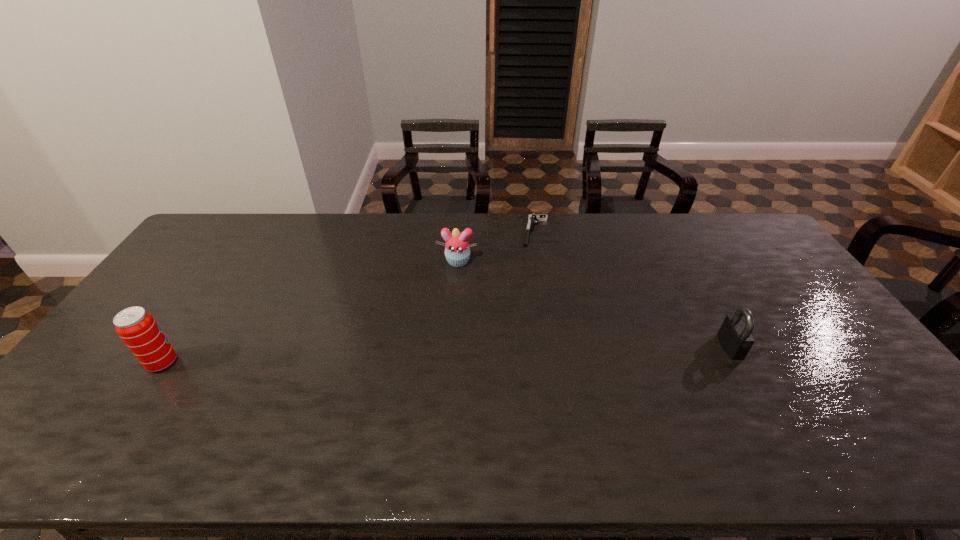
Identify the location of free space that is in between the cupcake and the tallest object. The image size is (960, 540). (310, 312).

Locate an element on the screen. This screenshot has height=540, width=960. free spot between the second farthest object and the farthest object is located at coordinates (496, 246).

This screenshot has height=540, width=960. Find the location of `vacant area that lies between the second object from right to left and the tallest object`. vacant area that lies between the second object from right to left and the tallest object is located at coordinates (348, 297).

Find the location of a particular element. object that is the second closest one to the cupcake is located at coordinates (735, 335).

Locate an element on the screen. The width and height of the screenshot is (960, 540). object that is the closest to the third object from right to left is located at coordinates (532, 218).

Find the location of a particular element. The height and width of the screenshot is (540, 960). vacant area in the image that satisfies the following two spatial constraints: 1. on the front side of the rightmost object; 2. on the front of the third object from right to left near the keyhole is located at coordinates (452, 346).

Find the location of `free location that satisfies the following two spatial constraints: 1. on the front side of the padlock; 2. on the front of the third nearest object near the keyhole`. free location that satisfies the following two spatial constraints: 1. on the front side of the padlock; 2. on the front of the third nearest object near the keyhole is located at coordinates (452, 346).

You are a GUI agent. You are given a task and a screenshot of the screen. Output one action in this format:
    pyautogui.click(x=<x>, y=<y>)
    Task: Click on the vacant space that satisfies the following two spatial constraints: 1. on the back side of the padlock; 2. on the front of the soda can near the keyhole
    
    Given the screenshot: What is the action you would take?
    pyautogui.click(x=174, y=346)

Identify the location of vacant space that satisfies the following two spatial constraints: 1. on the front side of the padlock; 2. on the front of the third object from right to left near the keyhole. This screenshot has height=540, width=960. (452, 346).

Locate an element on the screen. This screenshot has width=960, height=540. free point that satisfies the following two spatial constraints: 1. on the back side of the padlock; 2. on the front of the leftmost object near the keyhole is located at coordinates (174, 346).